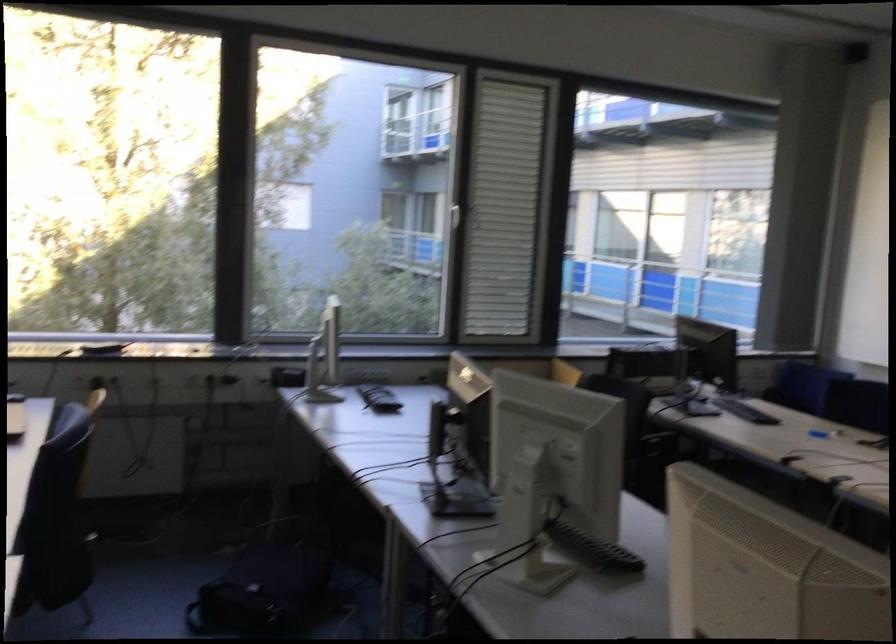
Locate an element on the screen. white window handle is located at coordinates (453, 216).